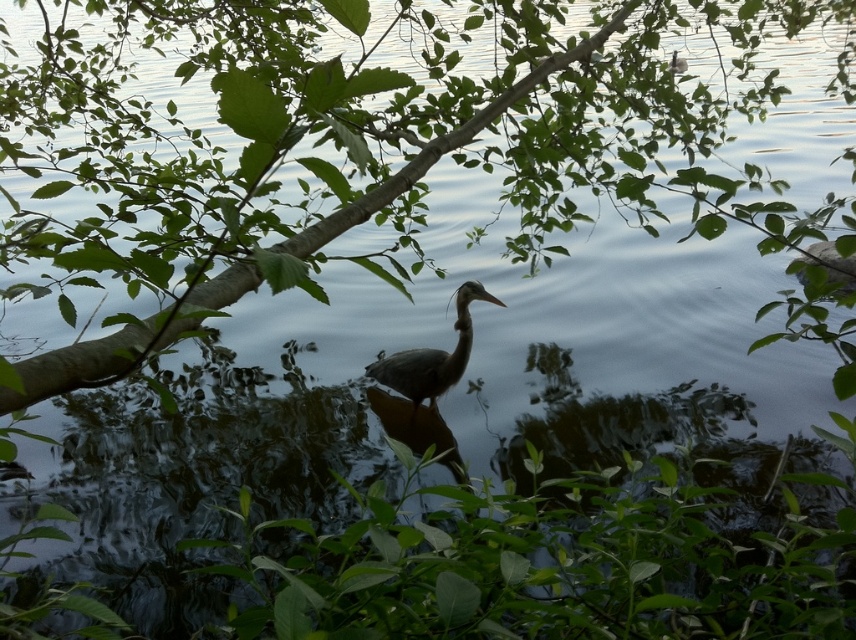
You are a photographer trying to capture the gray matte heron at center while ensuring the green leafy plant at lower center doesn not block the view. Based on their sizes, can you position yourself so that the heron is fully visible without the plant obstructing it?

The green leafy plant at lower center is larger than the gray matte heron at center. To ensure the heron is fully visible without obstruction, position yourself so that the smaller heron is placed in an area of the frame where the larger plant does not overlap it.

You are a photographer aiming to capture the gray matte heron at center and the green leafy plant at lower center in a single frame. Based on their positions, which object should you focus on first to ensure both are in focus?

The green leafy plant at lower center is below the gray matte heron at center, so you should focus on the gray matte heron at center first since it is closer to the camera, ensuring both objects will be in focus when focused on the closer one.